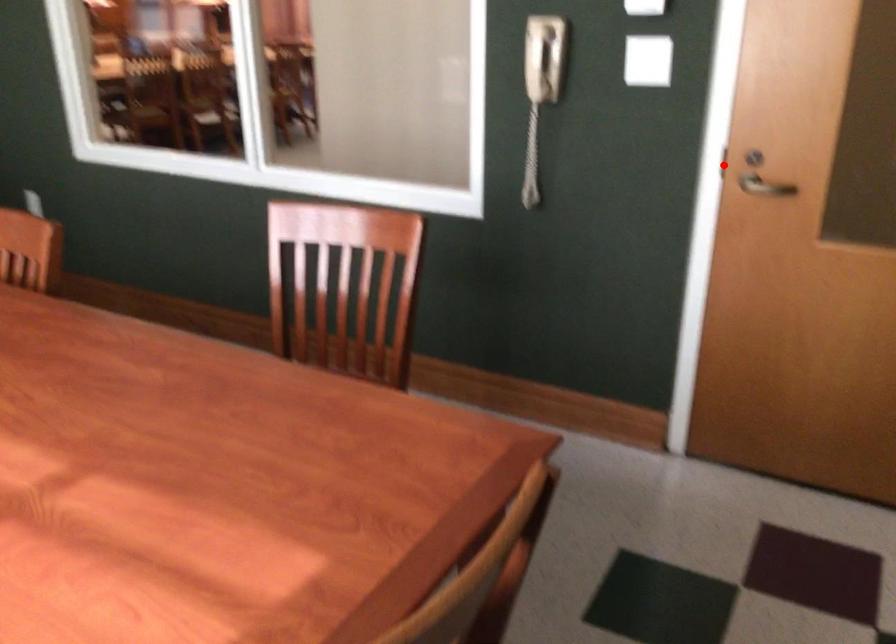
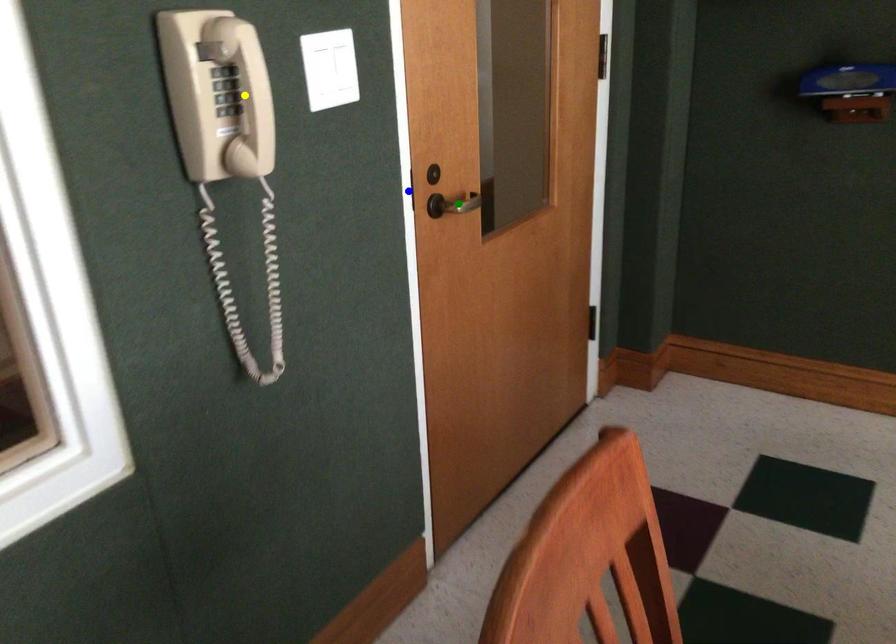
Question: I am providing you with two images of the same scene from different viewpoints. A red point is marked on the first image. You are given multiple points on the second image. Which mark in image 2 goes with the point in image 1?

Choices:
 (A) blue point
 (B) green point
 (C) yellow point

Answer: (A)